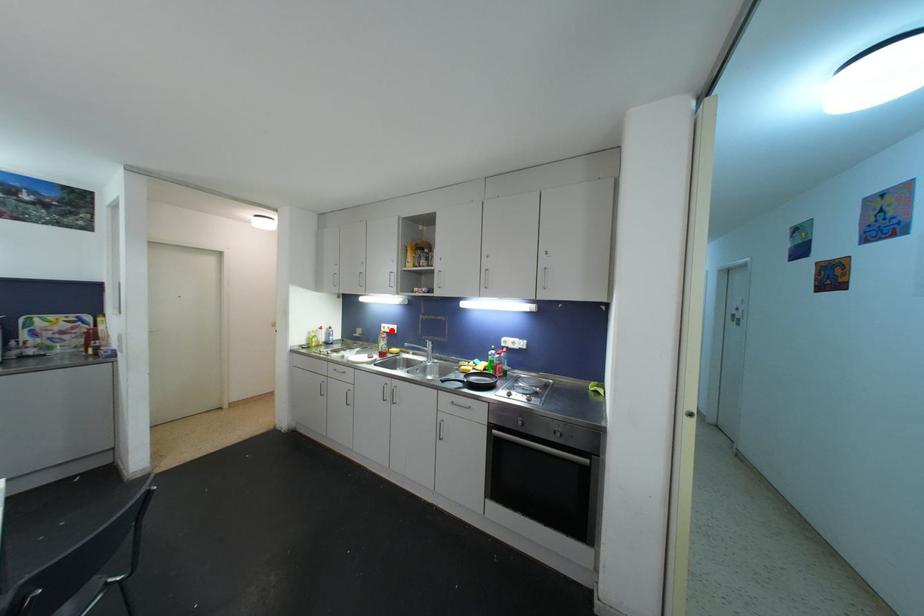
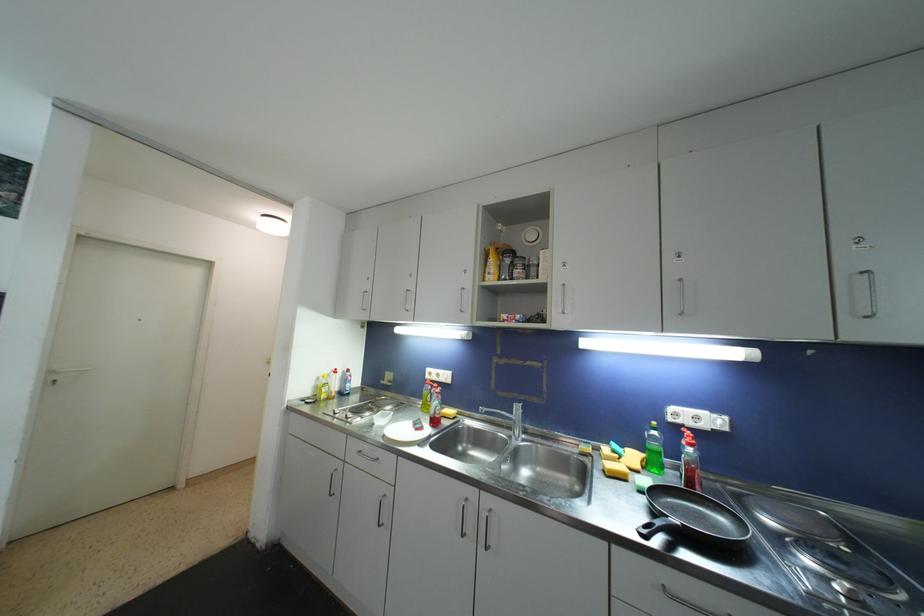
Where in the second image is the point corresponding to the highlighted location from the first image?

(441, 378)